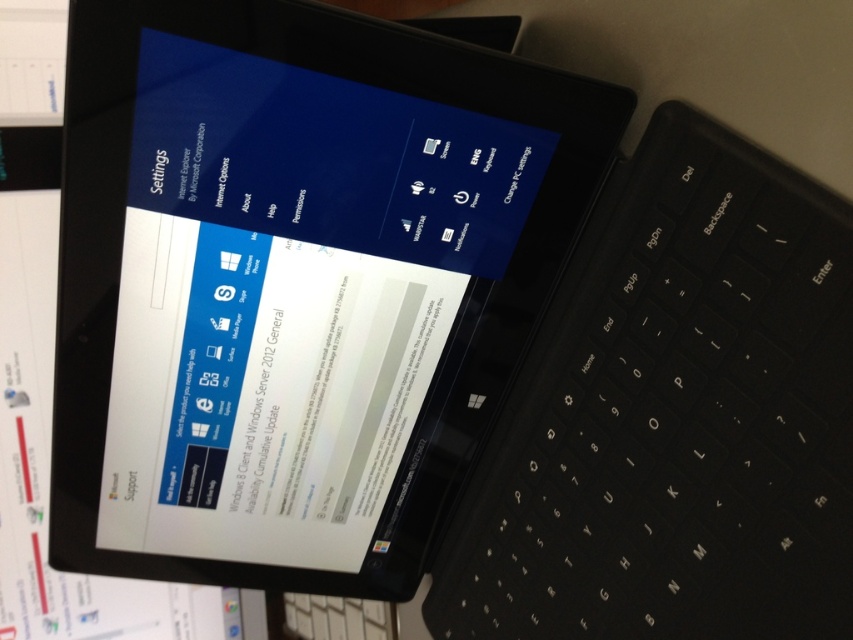
Which of these two, black glossy tablet at center or black plastic keyboard at center, stands taller?

Standing taller between the two is black glossy tablet at center.

Can you confirm if black glossy tablet at center is shorter than black plastic keyboard at center?

Incorrect, black glossy tablet at center's height does not fall short of black plastic keyboard at center's.

Is point (343, 204) farther from camera compared to point (648, 436)?

Yes, it is.

The width and height of the screenshot is (853, 640). Find the location of `black glossy tablet at center`. black glossy tablet at center is located at coordinates (294, 284).